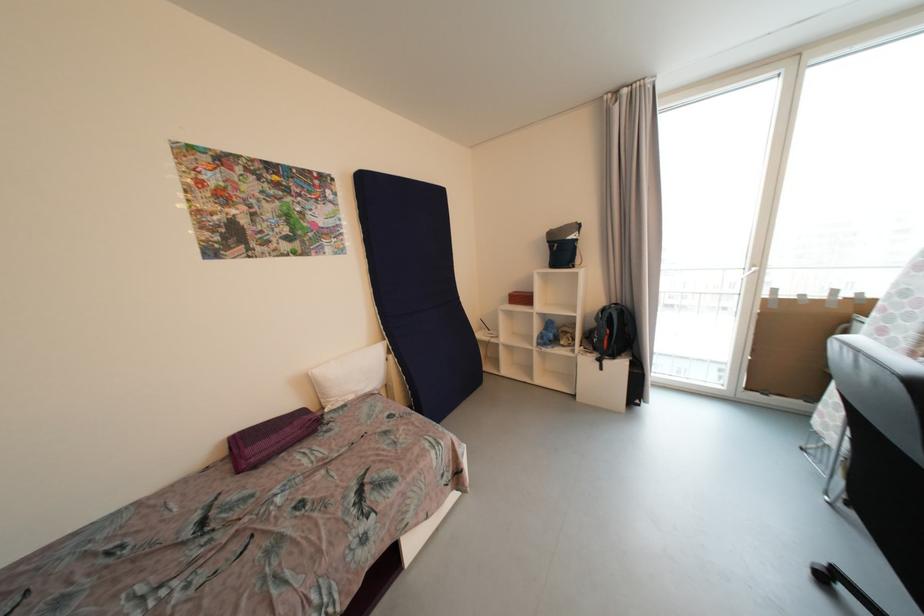
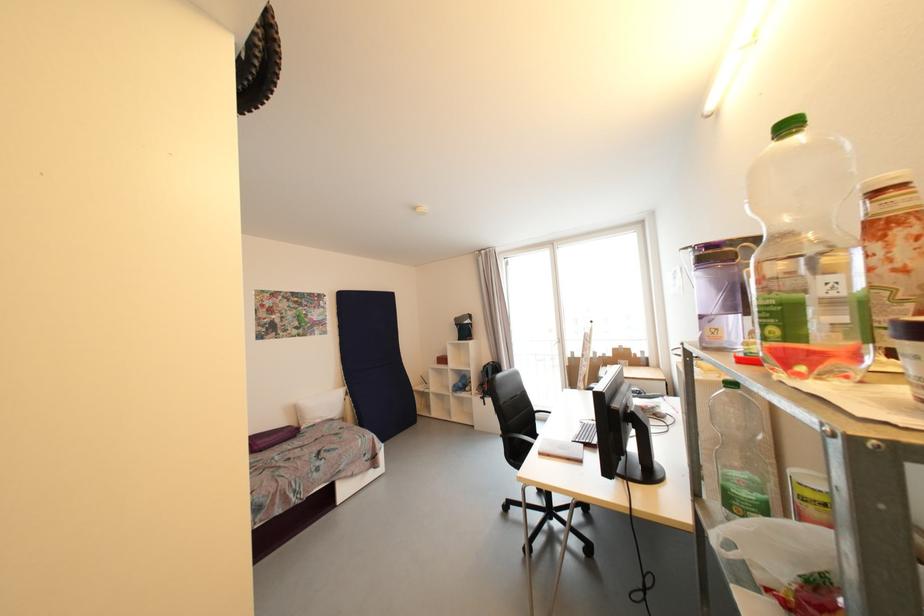
Locate, in the second image, the point that corresponds to point 608,312 in the first image.

(490, 368)